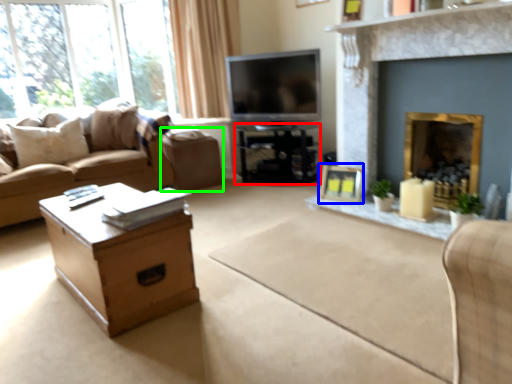
Question: Which object is the closest to the table (highlighted by a red box)? Choose among these: picture frame (highlighted by a blue box) or footrest (highlighted by a green box).

Choices:
 (A) picture frame
 (B) footrest

Answer: (B)